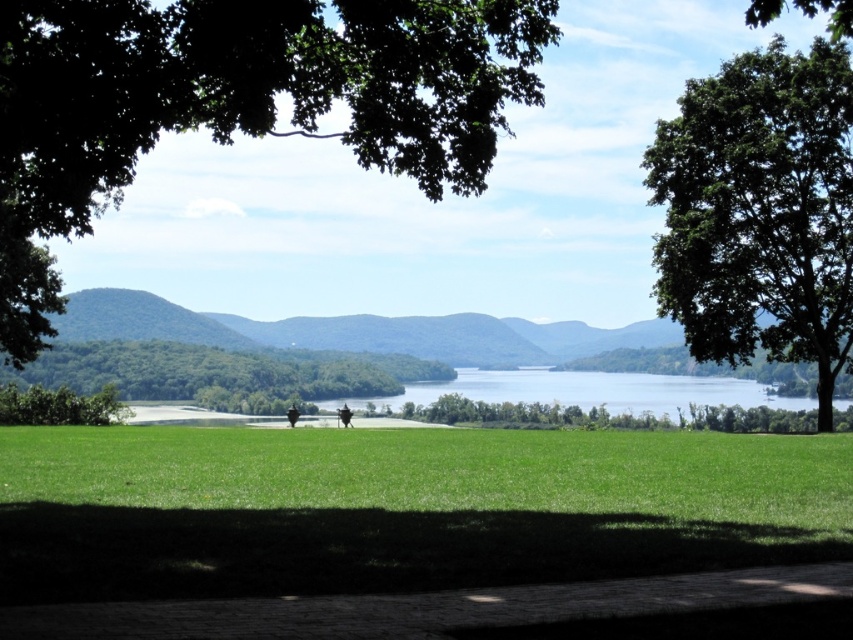
Question: Which object is closer to the camera taking this photo?

Choices:
 (A) green leafy tree at upper right
 (B) green leafy tree at center
 (C) matte black statue at center

Answer: (A)

Question: Can you confirm if dark green grass at center is bigger than matte black statue at center?

Choices:
 (A) no
 (B) yes

Answer: (B)

Question: Which of the following is the closest to the observer?

Choices:
 (A) (289, 410)
 (B) (416, 84)

Answer: (B)

Question: Can you confirm if green leafy tree at upper left is positioned to the left of matte black statue at center?

Choices:
 (A) no
 (B) yes

Answer: (A)

Question: Which point appears closest to the camera in this image?

Choices:
 (A) (341, 410)
 (B) (30, 205)
 (C) (679, 138)

Answer: (B)

Question: Is green leafy tree at upper left to the left of green leafy tree at center from the viewer's perspective?

Choices:
 (A) no
 (B) yes

Answer: (A)